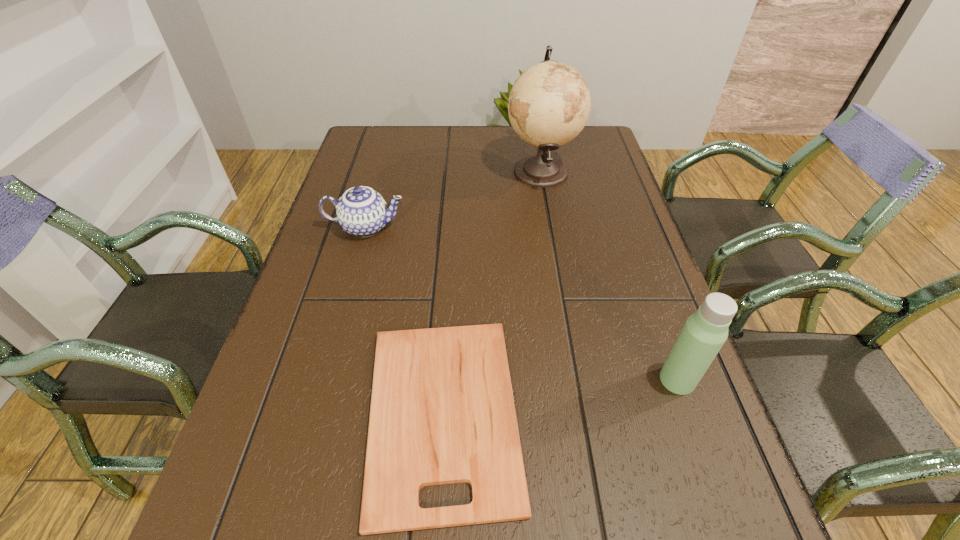
Identify the location of vacant space that satisfies the following two spatial constraints: 1. on the front-facing side of the globe; 2. on the front side of the shortest object. (583, 414).